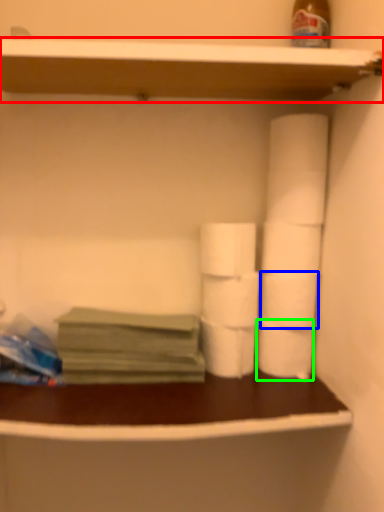
Question: Estimate the real-world distances between objects in this image. Which object is closer to shelf (highlighted by a red box), toilet paper (highlighted by a blue box) or toilet paper (highlighted by a green box)?

Choices:
 (A) toilet paper
 (B) toilet paper

Answer: (A)